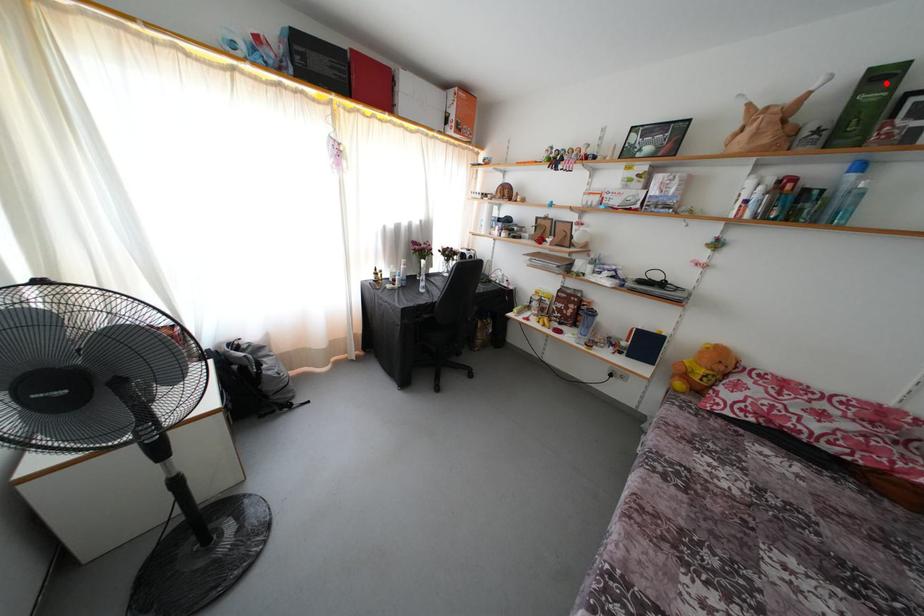
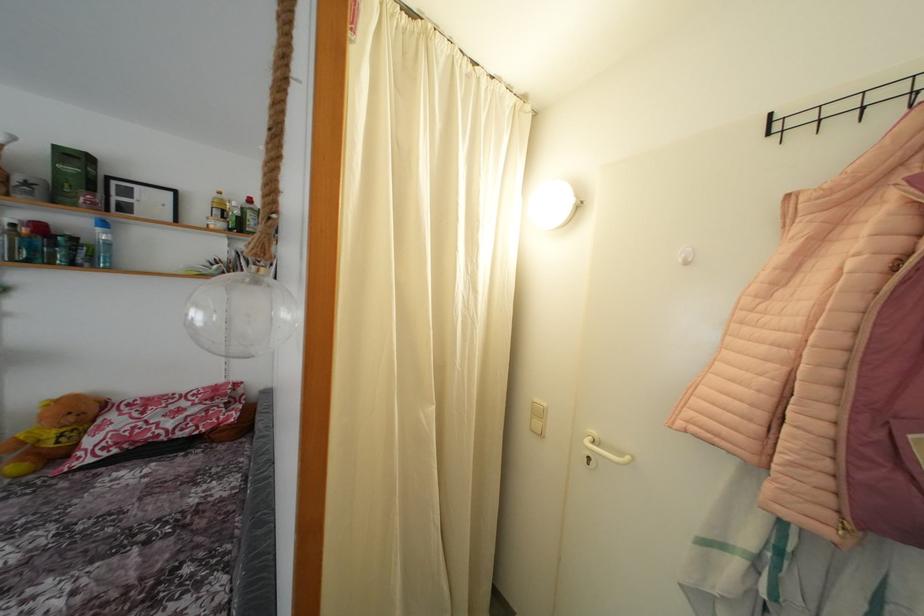
Question: I am providing you with two images of the same scene from different viewpoints. A red point is shown in image1. For the corresponding object point in image2, is it positioned nearer or farther from the camera?

Choices:
 (A) Nearer
 (B) Farther

Answer: (B)